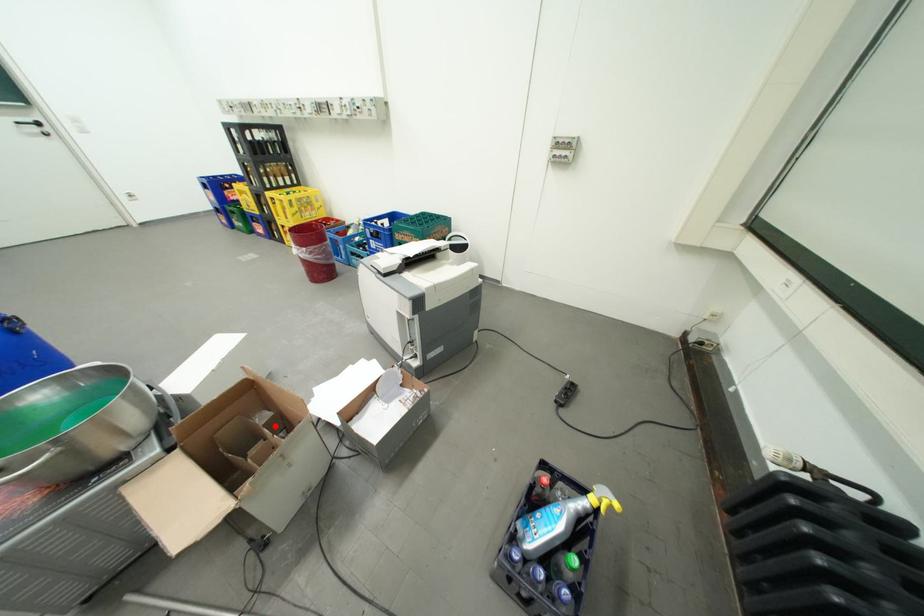
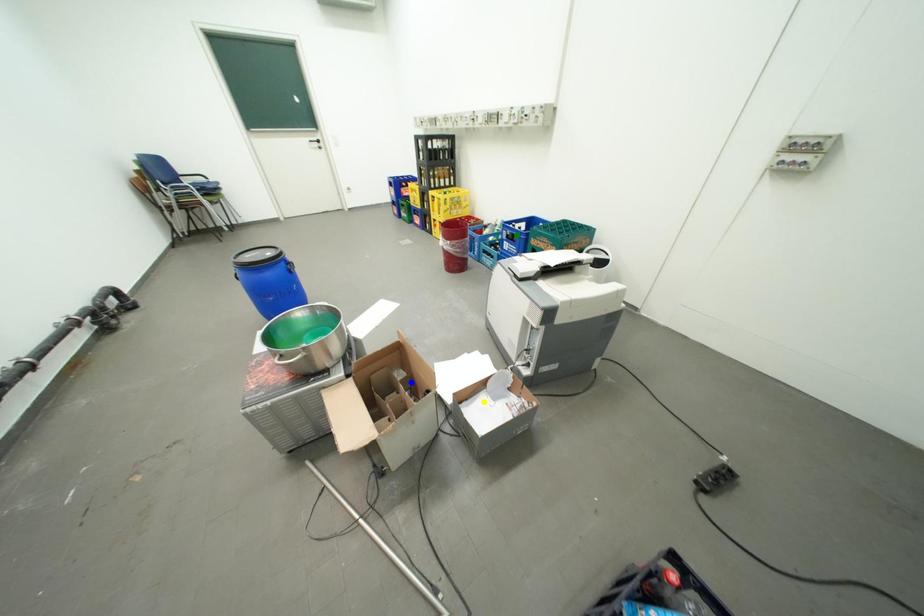
Question: I am providing you with two images of the same scene from different viewpoints. A red point is marked on the first image. You are given multiple points on the second image. Which point in image 2 represents the same 3d spot as the red point in image 1?

Choices:
 (A) blue point
 (B) green point
 (C) yellow point

Answer: (A)